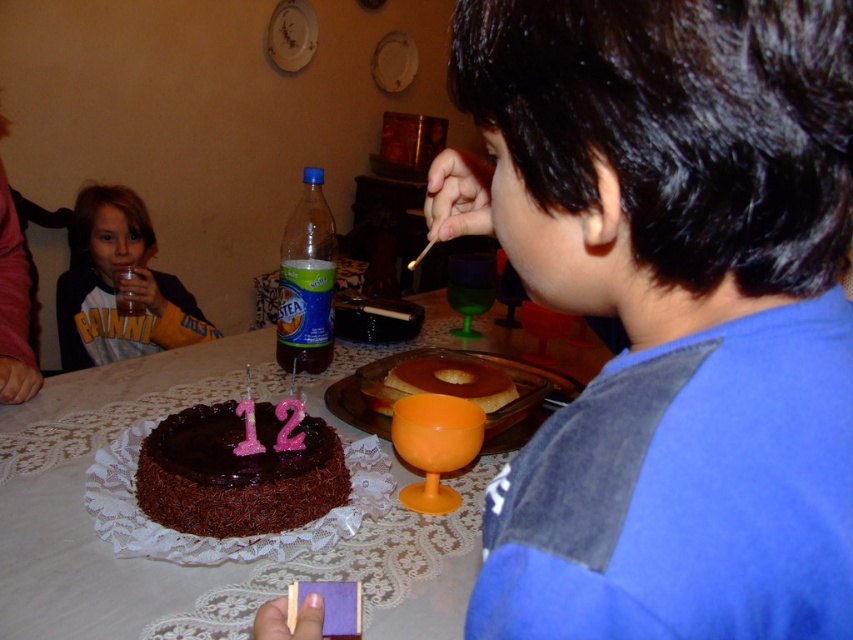
Question: Which of the following is the farthest from the observer?

Choices:
 (A) blue cotton shirt at right
 (B) white lace tablecloth at center
 (C) chocolatesmoothcake at lower center

Answer: (C)

Question: Is blue cotton shirt at right positioned before matte yellow shirt at left?

Choices:
 (A) yes
 (B) no

Answer: (A)

Question: Is matte yellow shirt at left wider than golden caramel flan at center?

Choices:
 (A) yes
 (B) no

Answer: (A)

Question: Which object is the closest to the white lace tablecloth at center?

Choices:
 (A) golden caramel flan at center
 (B) chocolatesmoothcake at lower center
 (C) blue cotton shirt at right

Answer: (A)

Question: Is chocolatesmoothcake at lower center below matte yellow shirt at left?

Choices:
 (A) no
 (B) yes

Answer: (B)

Question: Which of the following is the closest to the observer?

Choices:
 (A) (699, 140)
 (B) (199, 316)
 (C) (368, 380)
 (D) (270, 369)

Answer: (A)